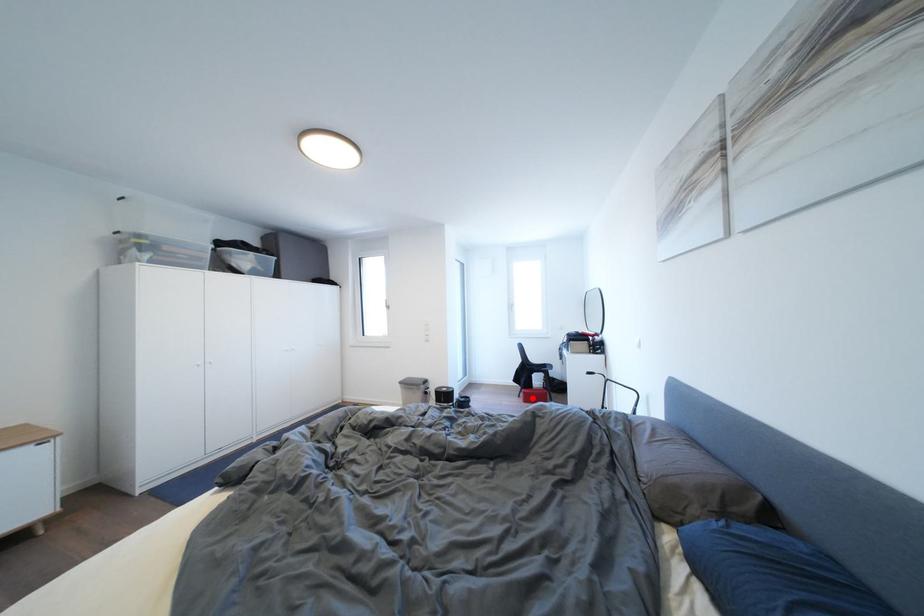
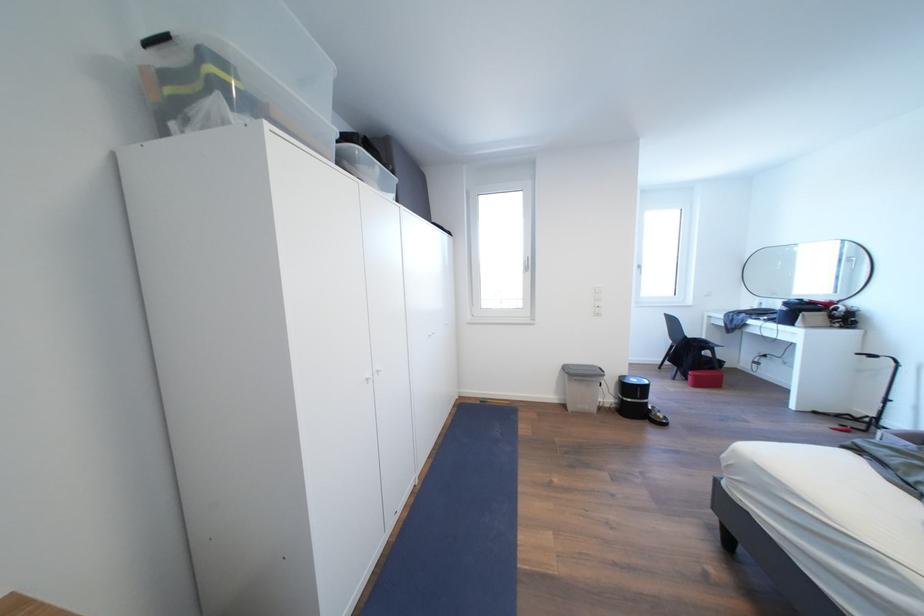
Question: I am providing you with two images of the same scene from different viewpoints. A red point is shown in image1. For the corresponding object point in image2, is it positioned nearer or farther from the camera?

Choices:
 (A) Nearer
 (B) Farther

Answer: (A)